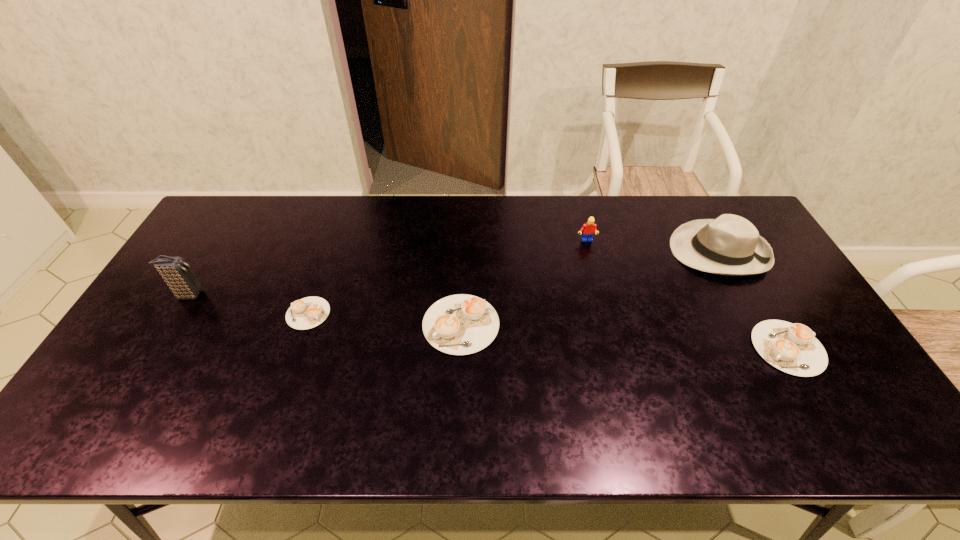
I want to click on object situated at the near edge, so click(x=792, y=348).

Identify the location of object at the left edge. (178, 275).

Locate an element on the screen. This screenshot has height=540, width=960. cappuccino that is positioned at the right edge is located at coordinates (792, 348).

Identify the location of fedora present at the right edge. Image resolution: width=960 pixels, height=540 pixels. (730, 245).

This screenshot has height=540, width=960. I want to click on object situated at the far right corner, so click(730, 245).

Where is `object located at the near right corner`? This screenshot has height=540, width=960. object located at the near right corner is located at coordinates (792, 348).

In the image, there is a desktop. In order to click on blank space at the far edge in this screenshot , I will do `click(484, 206)`.

The height and width of the screenshot is (540, 960). In the image, there is a desktop. In order to click on vacant space at the near edge in this screenshot , I will do `click(437, 399)`.

You are a GUI agent. You are given a task and a screenshot of the screen. Output one action in this format:
    pyautogui.click(x=<x>, y=<y>)
    Task: Click on the free spot between the third object from right to left and the fourth object from right to left
    The height and width of the screenshot is (540, 960).
    Given the screenshot: What is the action you would take?
    pyautogui.click(x=523, y=283)

At what (x,y) coordinates should I click in order to perform the action: click on free space between the clutch bag and the shortest object. Please return your answer as a coordinate pair (x, y). Looking at the image, I should click on click(x=249, y=304).